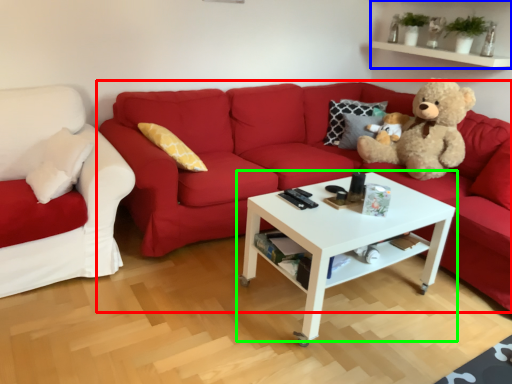
Question: Considering the real-world distances, which object is closest to studio couch (highlighted by a red box)? shelf (highlighted by a blue box) or coffee table (highlighted by a green box).

Choices:
 (A) shelf
 (B) coffee table

Answer: (B)